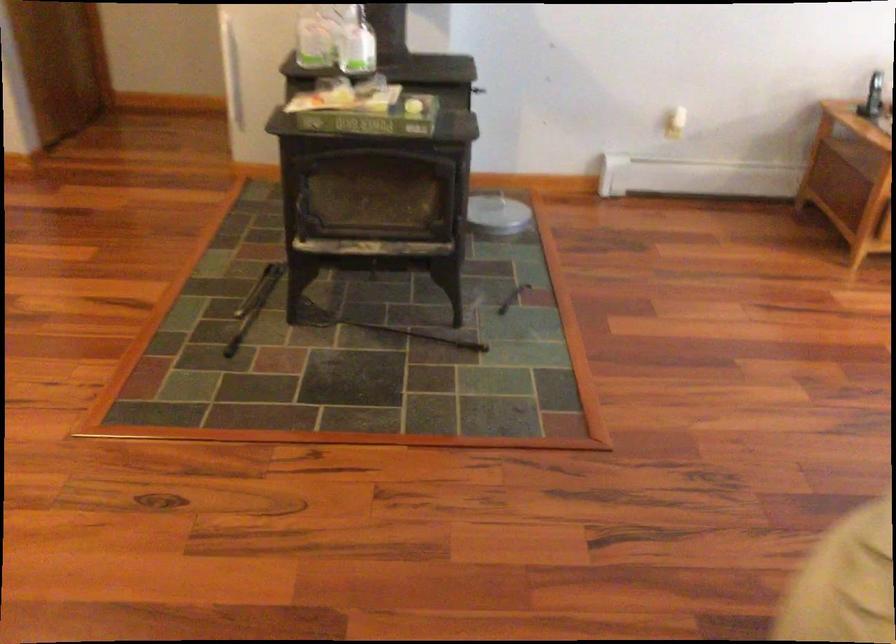
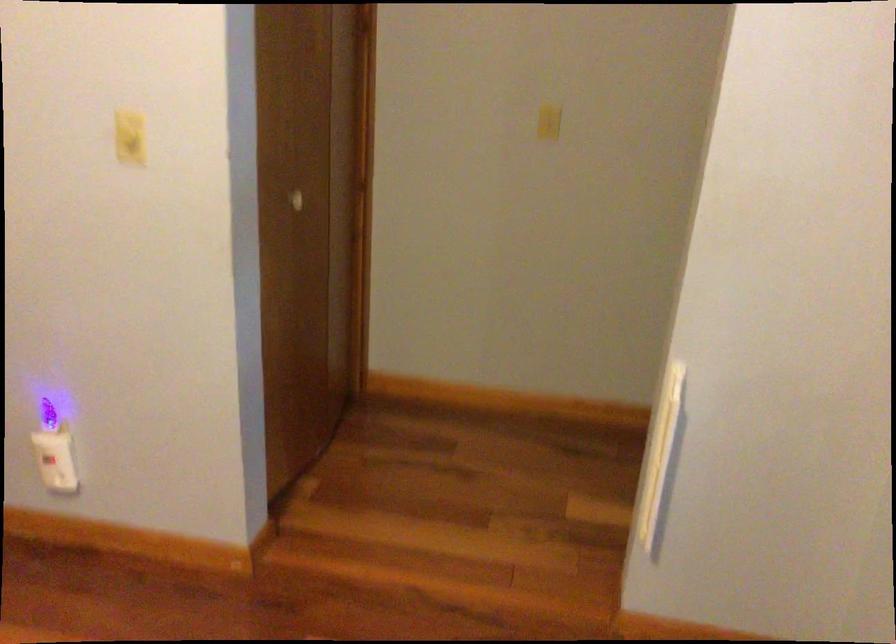
Which direction would the cameraman need to move to produce the second image?

The movement direction of the cameraman is left, forward.